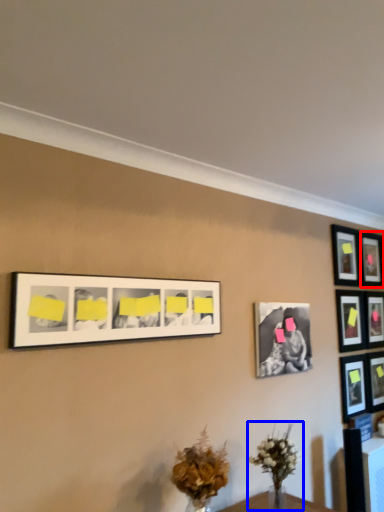
Question: Which of the following is the farthest to the observer, picture frame (highlighted by a red box) or floral arrangement (highlighted by a blue box)?

Choices:
 (A) picture frame
 (B) floral arrangement

Answer: (A)